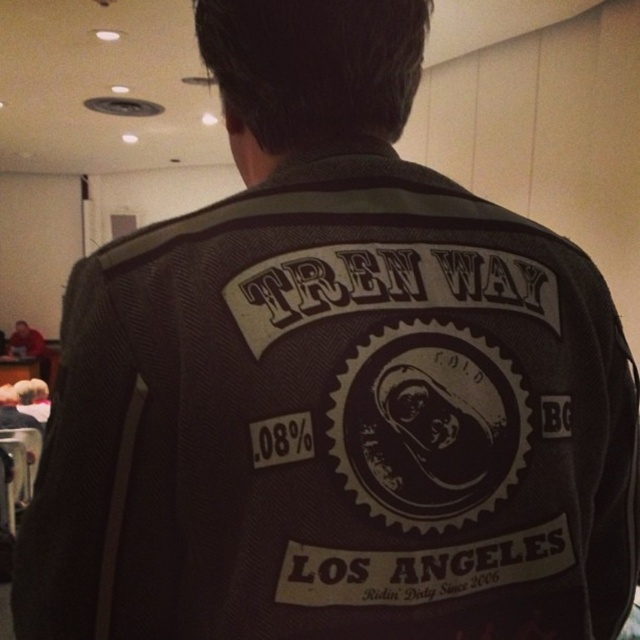
Question: Is black matte patch at center above red leather jacket at lower left?

Choices:
 (A) yes
 (B) no

Answer: (A)

Question: Which point is closer to the camera?

Choices:
 (A) (35, 337)
 (B) (376, 509)

Answer: (B)

Question: Which point is closer to the camera?

Choices:
 (A) black matte patch at center
 (B) red leather jacket at lower left

Answer: (A)

Question: Which object appears closest to the camera in this image?

Choices:
 (A) red leather jacket at lower left
 (B) black matte patch at center

Answer: (B)

Question: Does black matte patch at center have a smaller size compared to red leather jacket at lower left?

Choices:
 (A) yes
 (B) no

Answer: (A)

Question: Can you confirm if black matte patch at center is positioned above red leather jacket at lower left?

Choices:
 (A) yes
 (B) no

Answer: (A)